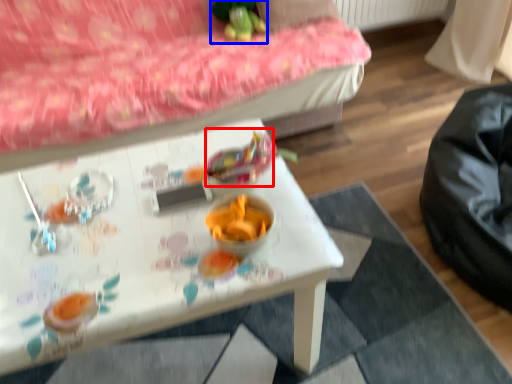
Question: Which object appears closest to the camera in this image, food (highlighted by a red box) or toy (highlighted by a blue box)?

Choices:
 (A) food
 (B) toy

Answer: (A)